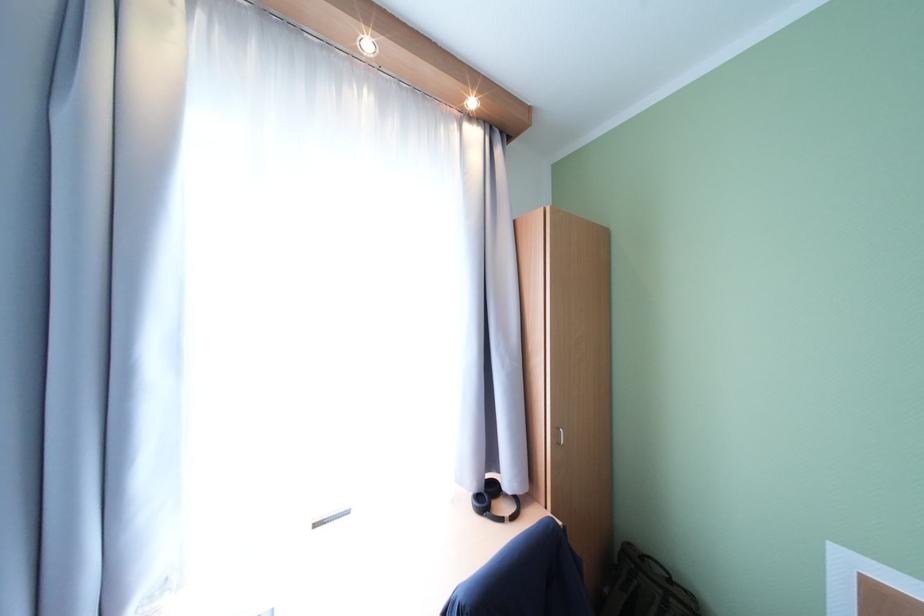
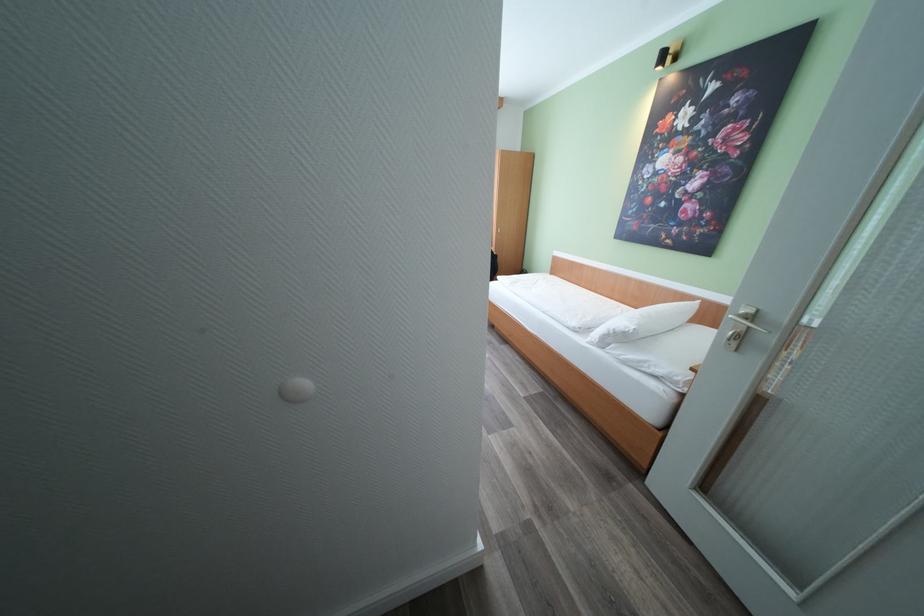
Question: I am providing you with two images of the same scene from different viewpoints. Which of the following objects are not visible in image2?

Choices:
 (A) silver door handle
 (B) green backpack
 (C) small black box
 (D) white pillow

Answer: (B)